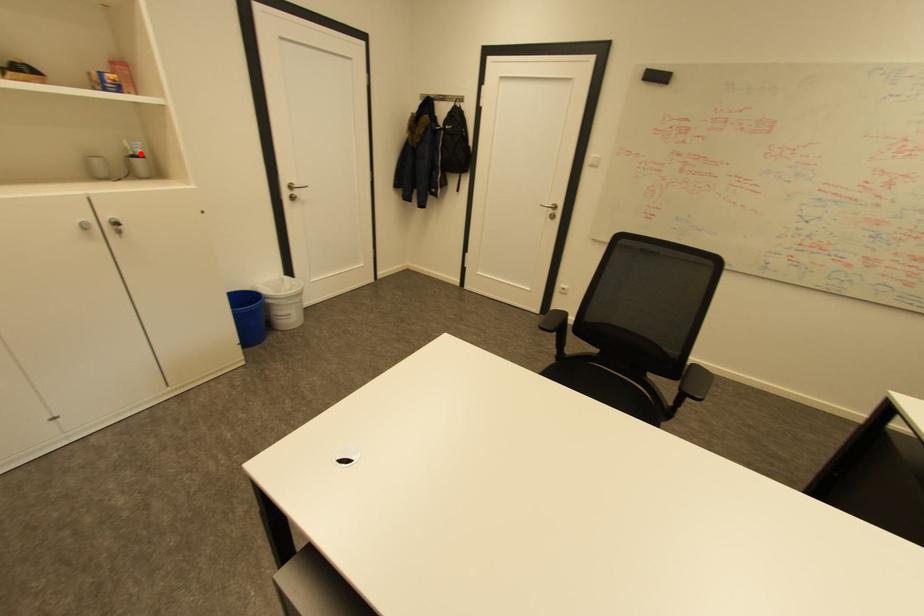
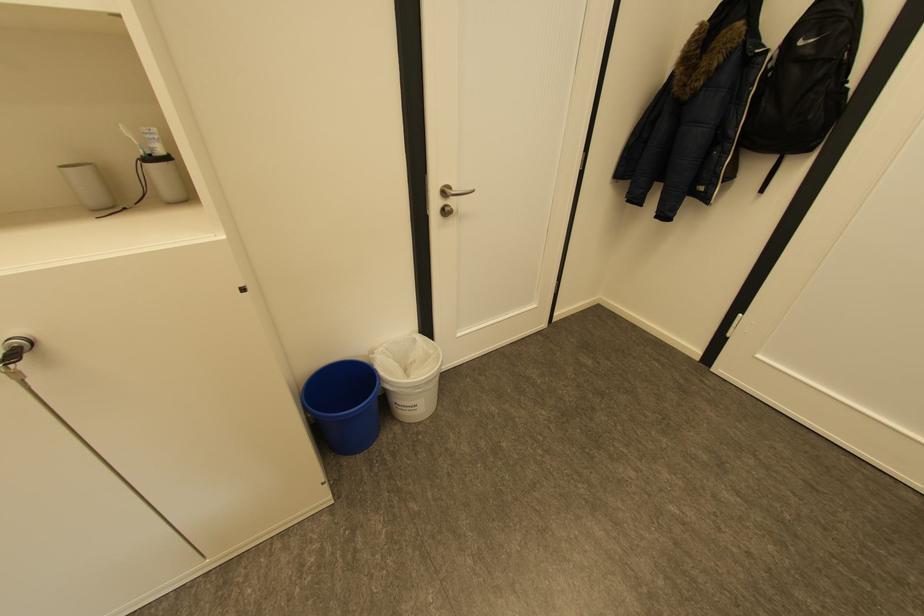
Question: I am providing you with two images of the same scene from different viewpoints. A red point is marked on the first image. At the location where the point appears in image 1, is it still visible in image 2?

Choices:
 (A) Yes
 (B) No

Answer: (A)